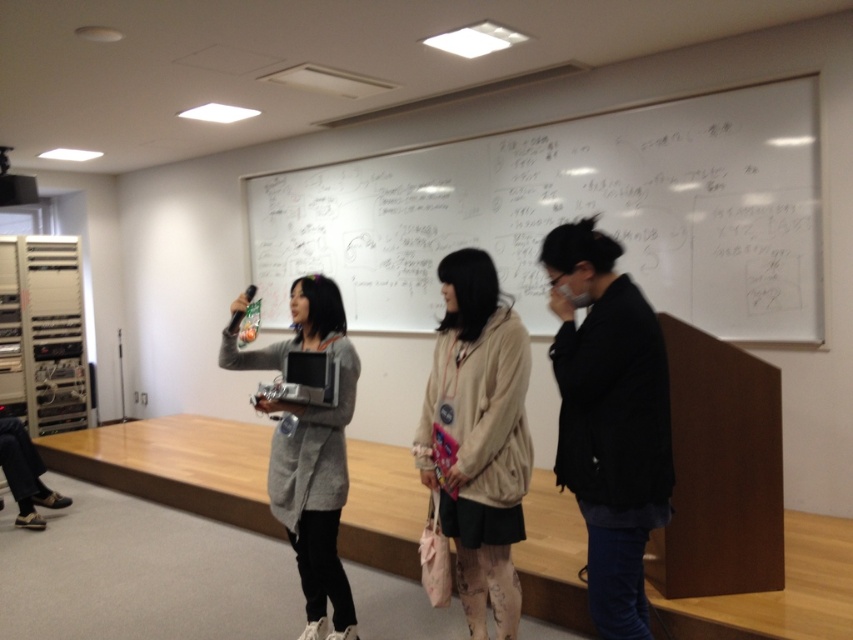
You are standing in the classroom facing the stage. There are two points marked on the whiteboard. The first point is at coordinates point [749,260] and the second is at point [560,333]. Which point is closer to you?

Point [749,260] is further to the viewer than point [560,333], so the second point is closer to you.

Consider the image. You are a student in the classroom and want to place a notebook between the black matte jacket at center and the beige fabric jacket at center. Can you fit the notebook between them?

The black matte jacket at center has a lesser width compared to beige fabric jacket at center. The total width between them is not provided, so it is unclear if the notebook can fit. However, since the black matte jacket at center is narrower, there might be enough space between them for the notebook.

You are standing at the entrance of the classroom and want to locate the black matte jacket at center. According to the coordinates given, where should you look?

The black matte jacket at center is located at coordinates point (x=608, y=419).